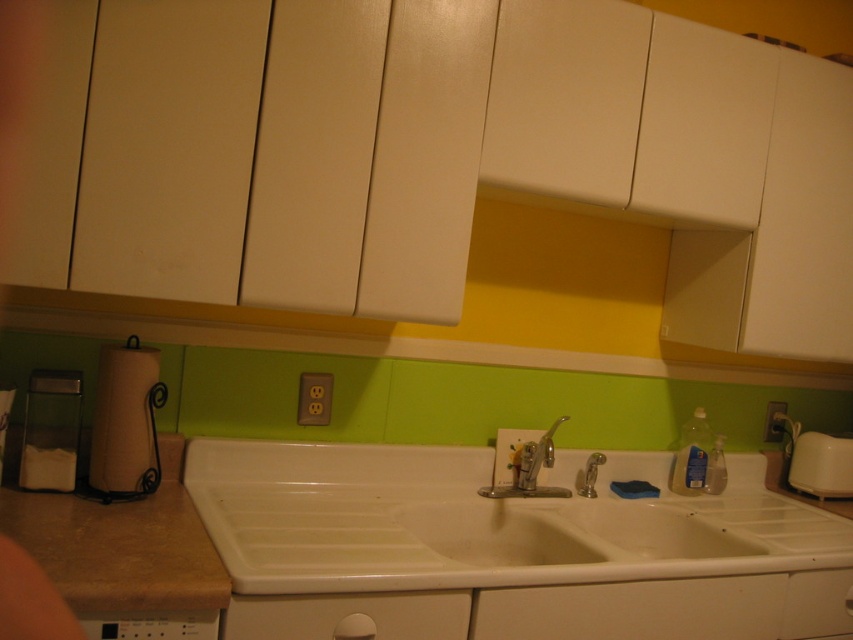
Can you confirm if beige laminate counter top at center is positioned below silver metallic faucet at center?

Yes.

Does beige laminate counter top at center have a greater height compared to silver metallic faucet at center?

Yes.

The height and width of the screenshot is (640, 853). What do you see at coordinates (445, 552) in the screenshot? I see `beige laminate counter top at center` at bounding box center [445, 552].

The width and height of the screenshot is (853, 640). I want to click on beige laminate counter top at center, so click(445, 552).

Does beige laminate counter top at center appear on the left side of white matte drawer at lower center?

Incorrect, beige laminate counter top at center is not on the left side of white matte drawer at lower center.

Does beige laminate counter top at center have a greater width compared to white matte drawer at lower center?

Yes.

Image resolution: width=853 pixels, height=640 pixels. Describe the element at coordinates (445, 552) in the screenshot. I see `beige laminate counter top at center` at that location.

This screenshot has height=640, width=853. What are the coordinates of `beige laminate counter top at center` in the screenshot? It's located at (445, 552).

You are a GUI agent. You are given a task and a screenshot of the screen. Output one action in this format:
    pyautogui.click(x=<x>, y=<y>)
    Task: Click on the white matte drawer at center
    The width and height of the screenshot is (853, 640).
    Given the screenshot: What is the action you would take?
    pyautogui.click(x=634, y=609)

Is white matte drawer at center taller than silver metallic faucet at center?

In fact, white matte drawer at center may be shorter than silver metallic faucet at center.

Is point (651, 595) in front of point (548, 428)?

Yes, it is.

Identify the location of white matte drawer at center. (634, 609).